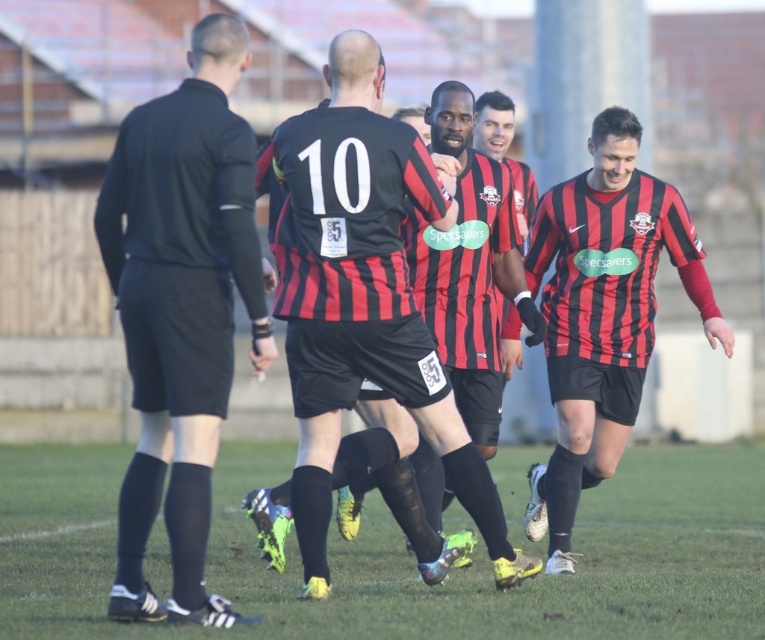
Question: Can you confirm if green grass at lower center is positioned above matte black soccer jersey at right?

Choices:
 (A) no
 (B) yes

Answer: (A)

Question: Based on their relative distances, which object is farther from the black matte referee at left?

Choices:
 (A) green grass at lower center
 (B) matte black soccer jersey at right

Answer: (A)

Question: Which object is the closest to the black matte referee at left?

Choices:
 (A) green grass at lower center
 (B) matte black soccer jersey at right

Answer: (B)

Question: Among these points, which one is farthest from the camera?

Choices:
 (A) tap(145, 385)
 (B) tap(702, 320)
 (C) tap(474, 600)

Answer: (B)

Question: Is black matte referee at left in front of matte black soccer jersey at right?

Choices:
 (A) no
 (B) yes

Answer: (B)

Question: Is black matte referee at left above matte black soccer jersey at right?

Choices:
 (A) no
 (B) yes

Answer: (B)